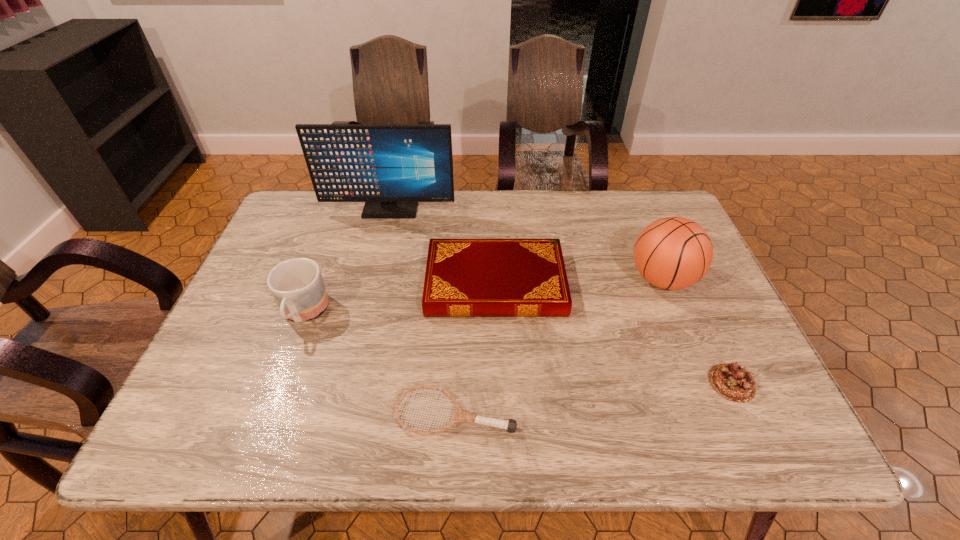
You are a GUI agent. You are given a task and a screenshot of the screen. Output one action in this format:
    pyautogui.click(x=<x>, y=<y>)
    Task: Click on the vacant space that is in between the computer monitor and the mug
    
    Given the screenshot: What is the action you would take?
    pyautogui.click(x=347, y=262)

You are a GUI agent. You are given a task and a screenshot of the screen. Output one action in this format:
    pyautogui.click(x=<x>, y=<y>)
    Task: Click on the vacant space in between the chocolate cake and the third tallest object
    
    Given the screenshot: What is the action you would take?
    pyautogui.click(x=517, y=348)

Choose which object is the second nearest neighbor to the mug. Please provide its 2D coordinates. Your answer should be formatted as a tuple, i.e. [(x, y)], where the tuple contains the x and y coordinates of a point satisfying the conditions above.

[(459, 415)]

You are a GUI agent. You are given a task and a screenshot of the screen. Output one action in this format:
    pyautogui.click(x=<x>, y=<y>)
    Task: Click on the object that is the closest to the basketball
    This screenshot has height=540, width=960.
    Given the screenshot: What is the action you would take?
    pyautogui.click(x=464, y=277)

Find the location of a particular element. free space in the image that satisfies the following two spatial constraints: 1. on the screen side of the chocolate cake; 2. on the left side of the farthest object is located at coordinates (348, 383).

I want to click on vacant point that satisfies the following two spatial constraints: 1. on the side with the handle of the chocolate cake; 2. on the left side of the mug, so click(x=277, y=383).

What are the coordinates of `vacant space that satisfies the following two spatial constraints: 1. on the screen side of the chocolate cake; 2. on the left side of the computer monitor` in the screenshot? It's located at (348, 383).

Locate an element on the screen. This screenshot has height=540, width=960. vacant area that satisfies the following two spatial constraints: 1. on the screen side of the fifth shortest object; 2. on the right side of the farthest object is located at coordinates (373, 279).